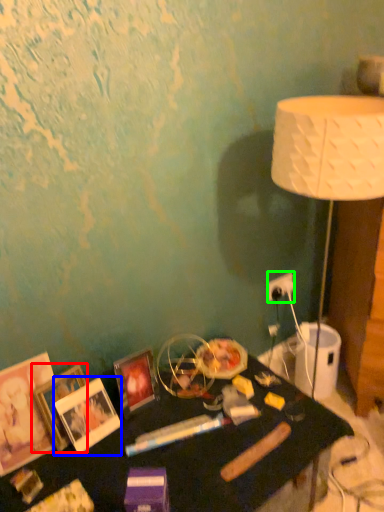
Question: Which is nearer to the picture frame (highlighted by a red box)? picture frame (highlighted by a blue box) or electric outlet (highlighted by a green box).

Choices:
 (A) picture frame
 (B) electric outlet

Answer: (A)